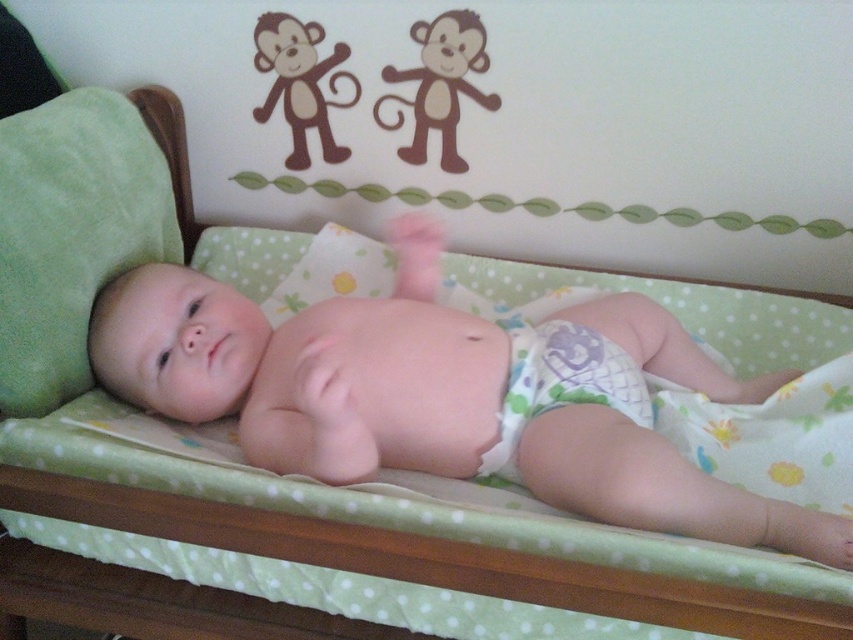
Question: Is smooth white diaper at center to the right of printed fabric diaper at center from the viewer's perspective?

Choices:
 (A) no
 (B) yes

Answer: (A)

Question: Is smooth white diaper at center further to the viewer compared to printed fabric diaper at center?

Choices:
 (A) yes
 (B) no

Answer: (B)

Question: Which object is farther from the camera taking this photo?

Choices:
 (A) printed fabric diaper at center
 (B) smooth white diaper at center

Answer: (A)

Question: Which point is farther to the camera?

Choices:
 (A) printed fabric diaper at center
 (B) smooth white diaper at center

Answer: (A)

Question: Does smooth white diaper at center come in front of printed fabric diaper at center?

Choices:
 (A) no
 (B) yes

Answer: (B)